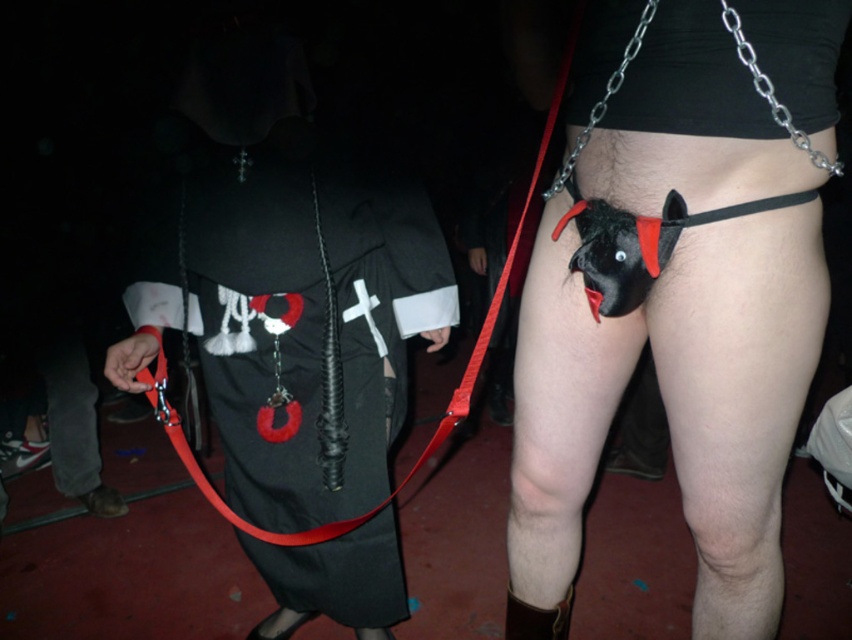
Is brown suede boot at lower left closer to camera compared to brown leather boot at lower center?

No, brown suede boot at lower left is behind brown leather boot at lower center.

Is brown suede boot at lower left smaller than brown leather boot at lower center?

No, brown suede boot at lower left is not smaller than brown leather boot at lower center.

Locate an element on the screen. This screenshot has height=640, width=852. brown suede boot at lower left is located at coordinates (75, 428).

Locate an element on the screen. Image resolution: width=852 pixels, height=640 pixels. brown suede boot at lower left is located at coordinates (75, 428).

Is matte black costume at center taller than brown leather boot at lower center?

Yes, matte black costume at center is taller than brown leather boot at lower center.

Can you confirm if matte black costume at center is smaller than brown leather boot at lower center?

Incorrect, matte black costume at center is not smaller in size than brown leather boot at lower center.

This screenshot has width=852, height=640. What are the coordinates of `matte black costume at center` in the screenshot? It's located at (286, 296).

Is black matte gimp mask at lower right bigger than metallic chain at lower center?

Correct, black matte gimp mask at lower right is larger in size than metallic chain at lower center.

Between point (586, 492) and point (563, 180), which one is positioned behind?

The point (586, 492) is more distant.

Locate an element on the screen. black matte gimp mask at lower right is located at coordinates (568, 396).